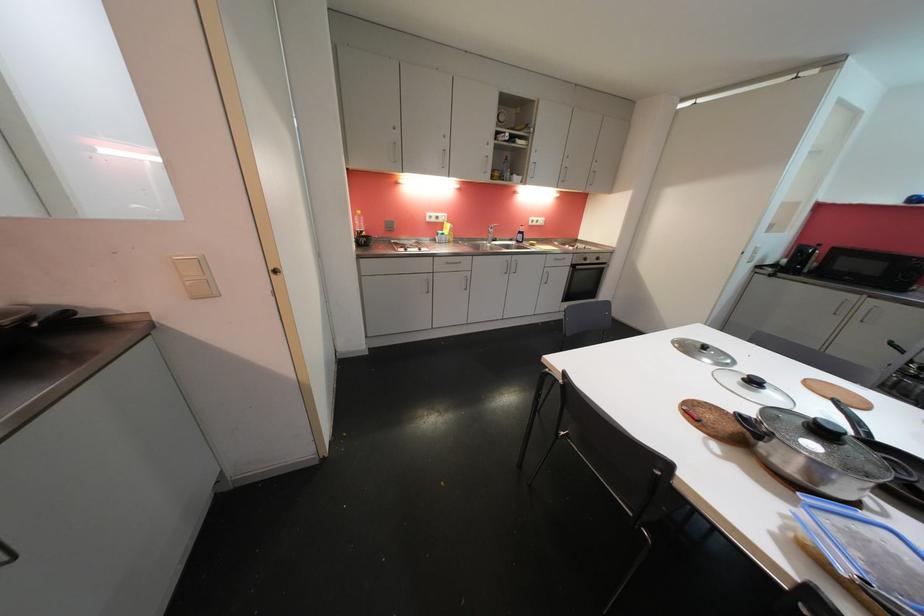
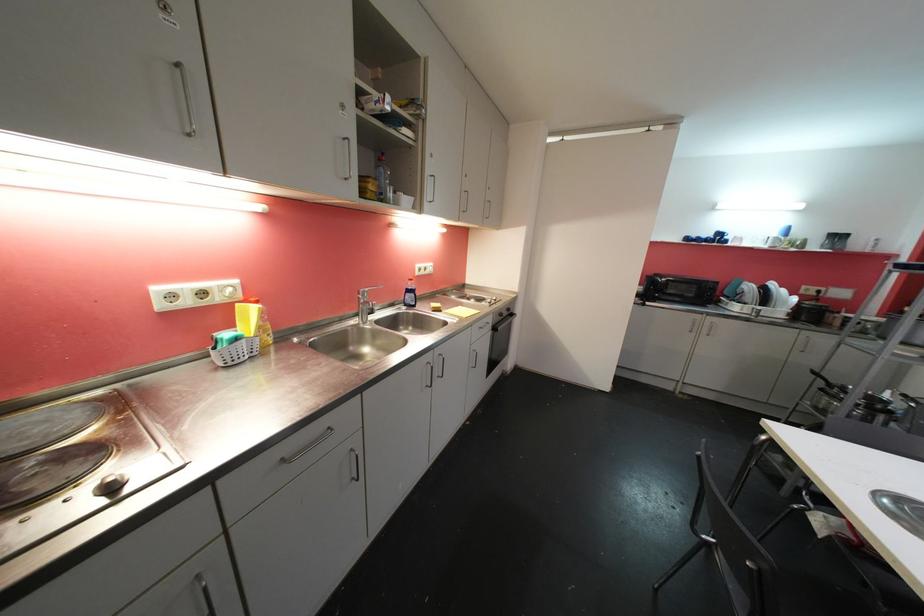
Locate, in the second image, the point that corresponds to [495,238] in the first image.

(370, 310)